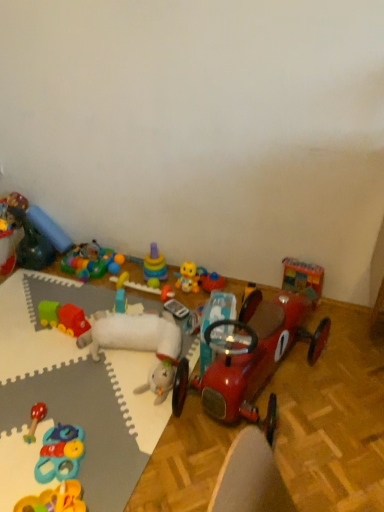
Where is `vacant space behind rubberized plastic toy at lower left, marked as the sixth toy in a right-to-left arrangement`? Image resolution: width=384 pixels, height=512 pixels. vacant space behind rubberized plastic toy at lower left, marked as the sixth toy in a right-to-left arrangement is located at coordinates (83, 406).